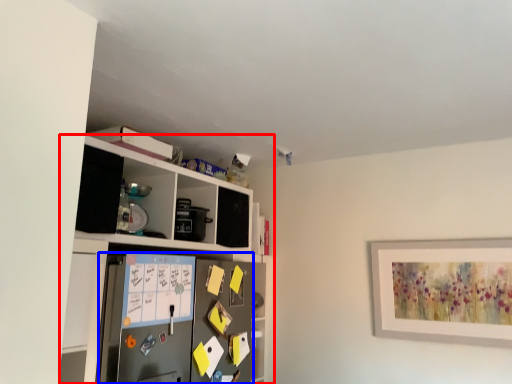
Question: Among these objects, which one is farthest to the camera, shelf (highlighted by a red box) or appliance (highlighted by a blue box)?

Choices:
 (A) shelf
 (B) appliance

Answer: (B)